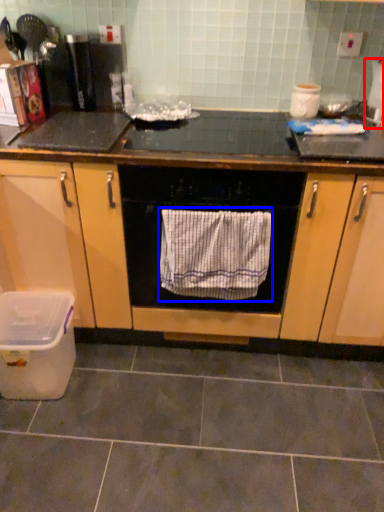
Question: Which point is further to the camera, appliance (highlighted by a red box) or bath towel (highlighted by a blue box)?

Choices:
 (A) appliance
 (B) bath towel

Answer: (A)